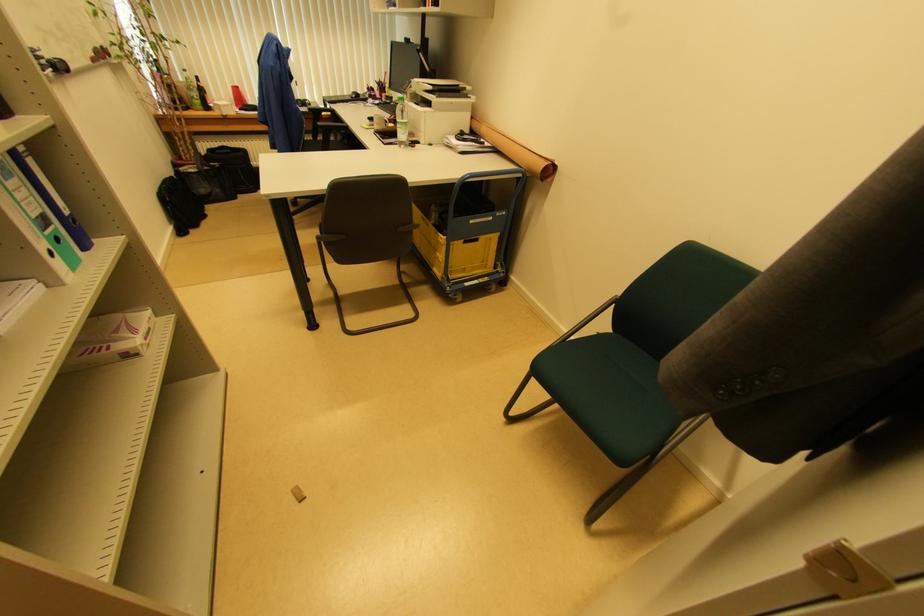
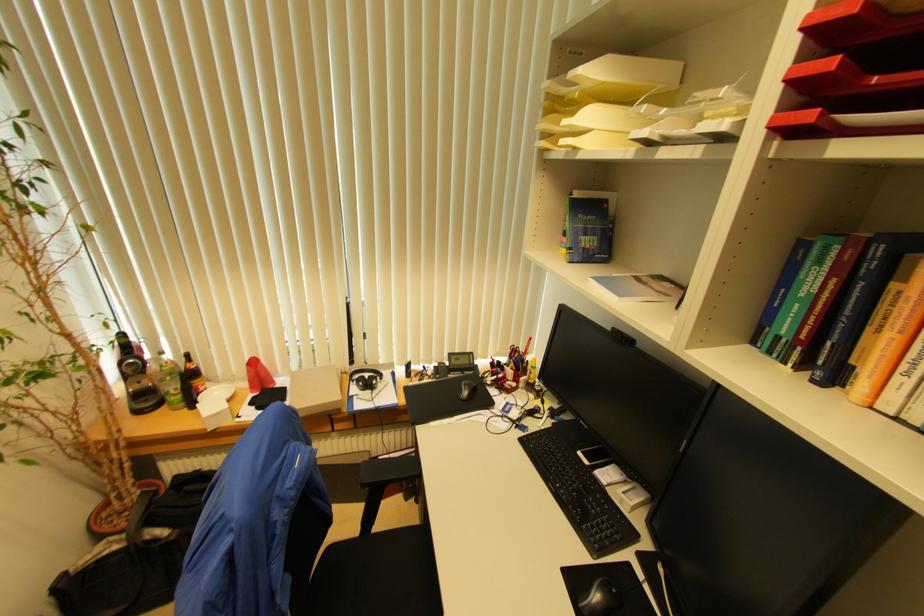
Locate, in the second image, the point that corresponds to point (355, 99) in the first image.

(467, 395)